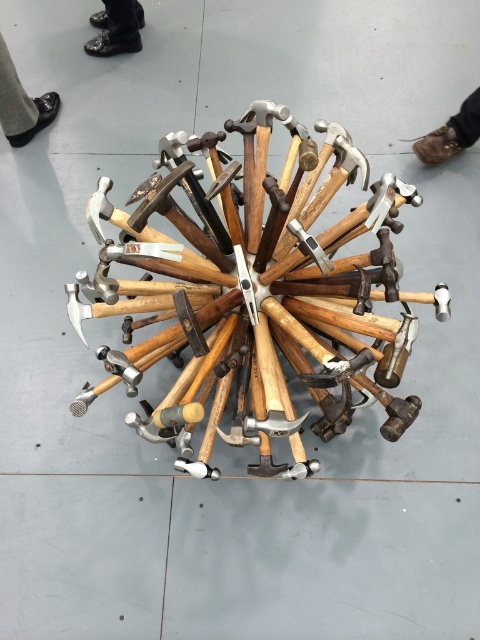
Question: Which object appears farthest from the camera in this image?

Choices:
 (A) wooden hammer at center
 (B) shiny leather shoes at upper left

Answer: (B)

Question: Can you confirm if black leather shoe at upper left is positioned above brown leather shoe at upper right?

Choices:
 (A) no
 (B) yes

Answer: (B)

Question: Can you confirm if black leather shoe at upper left is positioned to the right of shiny leather shoes at upper left?

Choices:
 (A) no
 (B) yes

Answer: (A)

Question: Does wooden hammer at center have a larger size compared to black leather shoe at upper left?

Choices:
 (A) no
 (B) yes

Answer: (B)

Question: Which object appears farthest from the camera in this image?

Choices:
 (A) shiny leather shoes at upper left
 (B) wooden hammer at center
 (C) brown leather shoe at upper right

Answer: (A)

Question: Which object is closer to the camera taking this photo?

Choices:
 (A) brown leather shoe at upper right
 (B) shiny leather shoes at upper left
 (C) black leather shoe at upper left

Answer: (C)